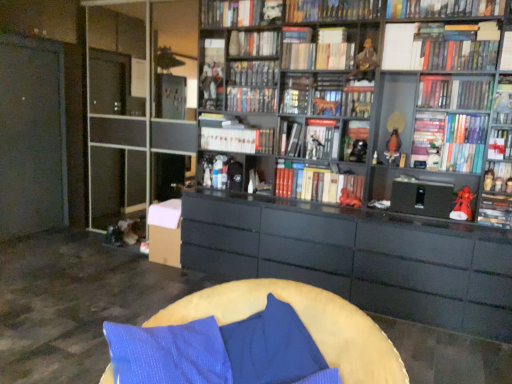
Question: In which direction should I rotate to look at white glossy book at center, acting as the 10th book starting from the bottom?

Choices:
 (A) right
 (B) left

Answer: (A)

Question: From a real-world perspective, is hardcover book at upper center, the eighteenth book positioned from the bottom, located higher than black matte bookshelf at center, which appears as the 9th book when viewed from the top?

Choices:
 (A) yes
 (B) no

Answer: (A)

Question: Does hardcover book at upper center, the second book when ordered from top to bottom, have a lesser height compared to black matte bookshelf at center, which appears as the 9th book when viewed from the top?

Choices:
 (A) yes
 (B) no

Answer: (A)

Question: From the image's perspective, is hardcover book at upper center, the eighteenth book positioned from the bottom, located beneath black matte bookshelf at center, which appears as the eleventh book when ordered from the bottom?

Choices:
 (A) yes
 (B) no

Answer: (B)

Question: Does hardcover book at upper center, the eighteenth book positioned from the bottom, have a lesser width compared to black matte bookshelf at center, which appears as the eleventh book when ordered from the bottom?

Choices:
 (A) no
 (B) yes

Answer: (A)

Question: Considering the relative sizes of hardcover book at upper center, the second book when ordered from top to bottom, and black matte bookshelf at center, which appears as the eleventh book when ordered from the bottom, in the image provided, is hardcover book at upper center, the second book when ordered from top to bottom, wider than black matte bookshelf at center, which appears as the eleventh book when ordered from the bottom,?

Choices:
 (A) yes
 (B) no

Answer: (A)

Question: Does hardcover book at upper center, the eighteenth book positioned from the bottom, appear on the left side of black matte bookshelf at center, which appears as the 9th book when viewed from the top?

Choices:
 (A) yes
 (B) no

Answer: (B)

Question: Does hardcover book at upper right, which is the eighth book in bottom-to-top order, appear on the left side of hardcover book at upper right, the twelfth book when ordered from bottom to top?

Choices:
 (A) no
 (B) yes

Answer: (B)

Question: Is hardcover book at upper right, marked as the 12th book in a top-to-bottom arrangement, smaller than hardcover book at upper right, the 8th book viewed from the top?

Choices:
 (A) yes
 (B) no

Answer: (A)

Question: Is hardcover book at upper right, which is the eighth book in bottom-to-top order, located outside hardcover book at upper right, the twelfth book when ordered from bottom to top?

Choices:
 (A) yes
 (B) no

Answer: (A)

Question: Can you confirm if hardcover book at upper right, which is the eighth book in bottom-to-top order, is shorter than hardcover book at upper right, the 8th book viewed from the top?

Choices:
 (A) no
 (B) yes

Answer: (B)

Question: Does hardcover book at upper right, which is the eighth book in bottom-to-top order, lie behind hardcover book at upper right, the twelfth book when ordered from bottom to top?

Choices:
 (A) yes
 (B) no

Answer: (A)

Question: From a real-world perspective, is hardcover book at upper right, marked as the 12th book in a top-to-bottom arrangement, beneath hardcover book at upper right, the 8th book viewed from the top?

Choices:
 (A) no
 (B) yes

Answer: (B)

Question: Can you confirm if matte black figurine at right, acting as the seventeenth book starting from the top, is taller than black matte bookshelf at center, which appears as the 9th book when viewed from the top?

Choices:
 (A) yes
 (B) no

Answer: (A)